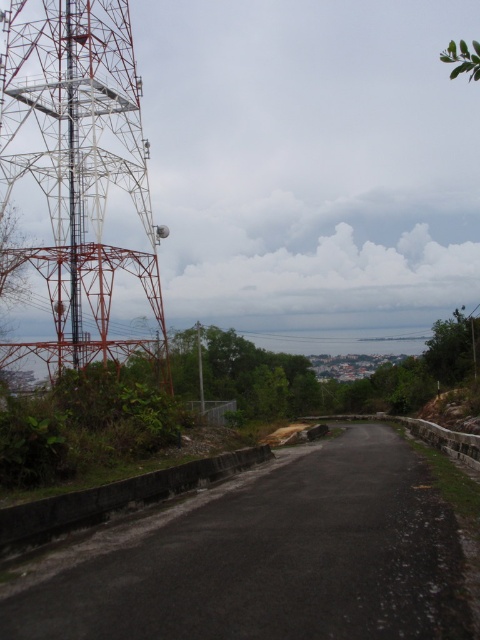
Question: Does metallic lattice tower at left come behind green bamboo pole at center?

Choices:
 (A) no
 (B) yes

Answer: (B)

Question: Is metallic lattice tower at left below green bamboo pole at center?

Choices:
 (A) no
 (B) yes

Answer: (A)

Question: Which of the following is the farthest from the observer?

Choices:
 (A) (201, 339)
 (B) (99, 308)

Answer: (A)

Question: Among these points, which one is farthest from the camera?

Choices:
 (A) (26, 72)
 (B) (199, 353)

Answer: (B)

Question: Can you confirm if metallic lattice tower at left is wider than green bamboo pole at center?

Choices:
 (A) yes
 (B) no

Answer: (A)

Question: Which object appears closest to the camera in this image?

Choices:
 (A) green bamboo pole at center
 (B) metallic lattice tower at left

Answer: (A)